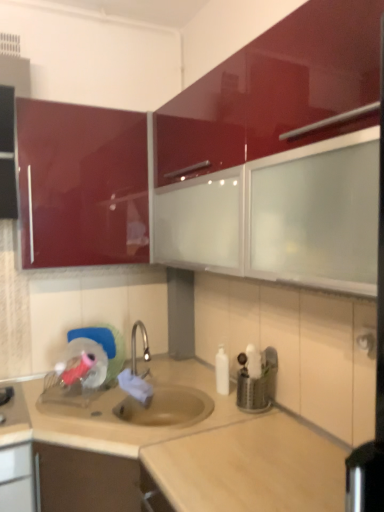
The height and width of the screenshot is (512, 384). Find the location of `free space in front of metallic silver utensil holder at center`. free space in front of metallic silver utensil holder at center is located at coordinates (268, 436).